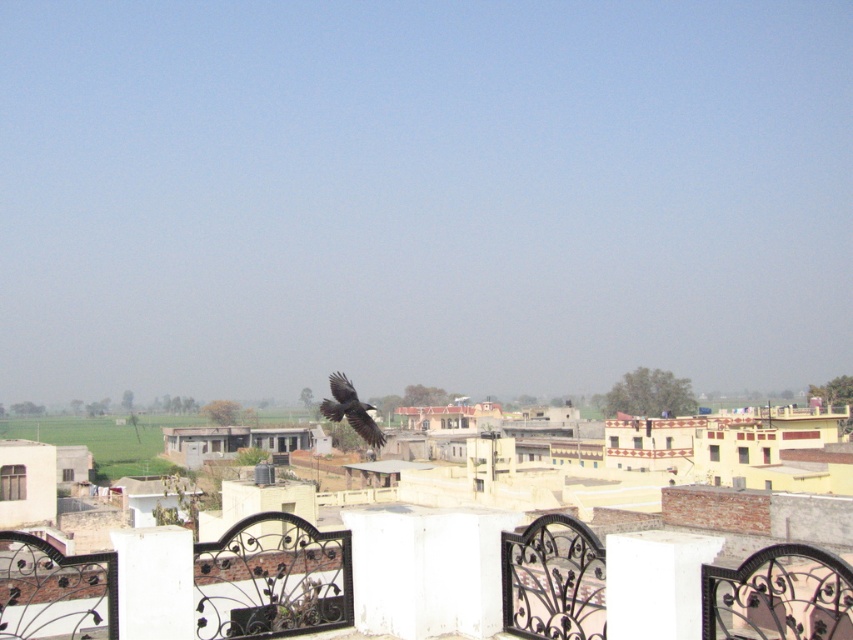
Does white painted concrete pillar at center appear on the left side of white smooth pillar at center?

Correct, you'll find white painted concrete pillar at center to the left of white smooth pillar at center.

Is point (381, 618) farther from camera compared to point (663, 573)?

Yes, point (381, 618) is behind point (663, 573).

You are a GUI agent. You are given a task and a screenshot of the screen. Output one action in this format:
    pyautogui.click(x=<x>, y=<y>)
    Task: Click on the white painted concrete pillar at center
    This screenshot has height=640, width=853.
    Given the screenshot: What is the action you would take?
    pyautogui.click(x=426, y=570)

Between black wrought iron fence at lower center and white smooth pillar at center, which one is positioned higher?

white smooth pillar at center is higher up.

Does black wrought iron fence at lower center have a larger size compared to white smooth pillar at center?

Yes.

Is point (491, 541) positioned before point (676, 614)?

No, it is behind (676, 614).

I want to click on black wrought iron fence at lower center, so click(x=268, y=579).

Can you confirm if white smooth pillar at center is positioned to the left of white matte pillar at lower left?

In fact, white smooth pillar at center is to the right of white matte pillar at lower left.

At what (x,y) coordinates should I click in order to perform the action: click on white smooth pillar at center. Please return your answer as a coordinate pair (x, y). The image size is (853, 640). Looking at the image, I should click on (654, 582).